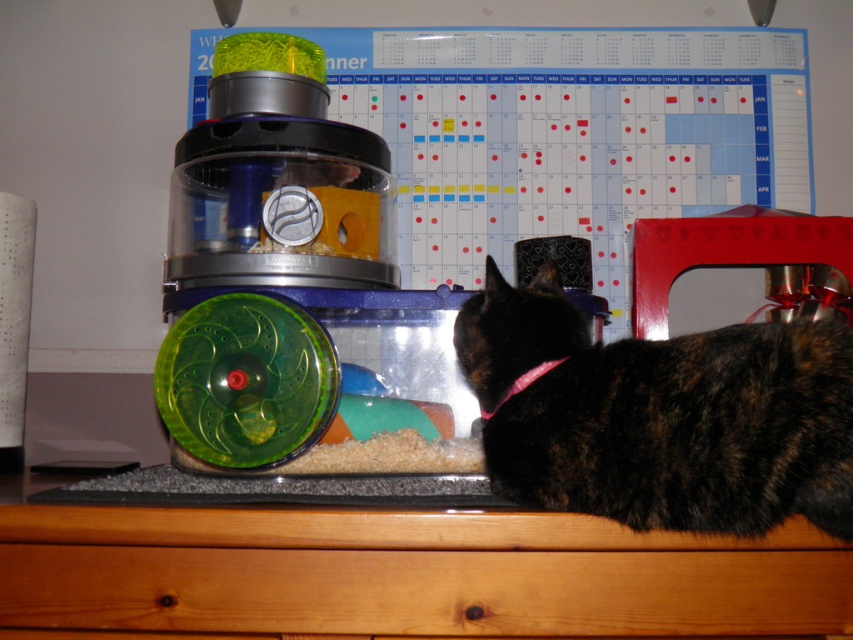
Question: Can you confirm if wooden drawer at lower center is positioned above tortoiseshell fur at right?

Choices:
 (A) yes
 (B) no

Answer: (B)

Question: Is wooden drawer at lower center smaller than tortoiseshell fur at right?

Choices:
 (A) yes
 (B) no

Answer: (A)

Question: Does wooden drawer at lower center lie in front of tortoiseshell fur at right?

Choices:
 (A) yes
 (B) no

Answer: (B)

Question: Which object appears farthest from the camera in this image?

Choices:
 (A) wooden drawer at lower center
 (B) tortoiseshell fur at right

Answer: (A)